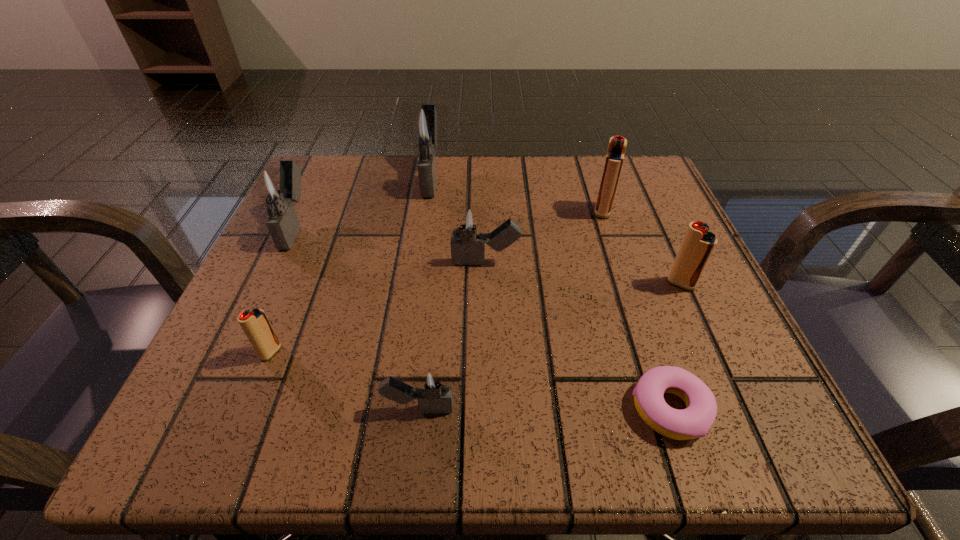
Where is `the nearest igniter`? This screenshot has width=960, height=540. the nearest igniter is located at coordinates (433, 391).

Identify the location of the nearest gray igniter. This screenshot has height=540, width=960. (433, 391).

Identify the location of pink doughnut. (695, 421).

Locate an element on the screen. the shortest object is located at coordinates (695, 421).

You are a GUI agent. You are given a task and a screenshot of the screen. Output one action in this format:
    pyautogui.click(x=<x>, y=<y>)
    Task: Click on the vacant space located on the left of the farthest gray igniter
    This screenshot has width=960, height=540.
    Given the screenshot: What is the action you would take?
    pyautogui.click(x=316, y=176)

Where is `free location located 0.060m on the back of the second red igniter from right to left`? free location located 0.060m on the back of the second red igniter from right to left is located at coordinates (594, 186).

The height and width of the screenshot is (540, 960). I want to click on free spot located 0.100m on the front of the third smallest gray igniter, so 264,294.

Find the location of a particular element. This screenshot has height=540, width=960. vacant space located 0.120m on the back of the second smallest gray igniter is located at coordinates (485, 209).

The height and width of the screenshot is (540, 960). In order to click on free space located on the left of the third nearest igniter in this screenshot , I will do `click(502, 284)`.

Find the location of a particular element. This screenshot has height=540, width=960. vacant space situated on the right of the sixth farthest object is located at coordinates (443, 352).